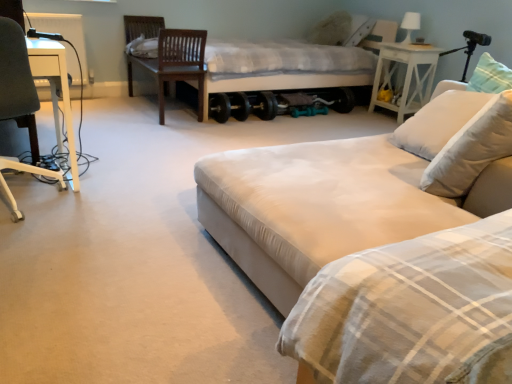
The height and width of the screenshot is (384, 512). In order to click on free space above white plastic radiator at upper left (from a real-world perspective) in this screenshot , I will do `click(53, 12)`.